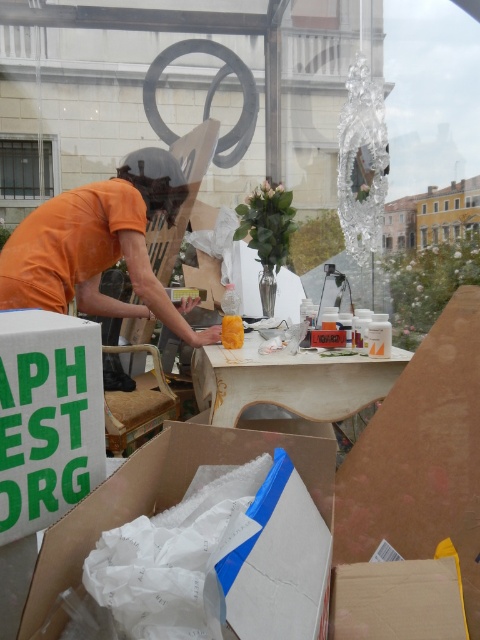
Can you confirm if orange cotton shirt at left is thinner than white foam at lower left?

No, orange cotton shirt at left is not thinner than white foam at lower left.

Which of these two, orange cotton shirt at left or white foam at lower left, stands shorter?

With less height is white foam at lower left.

At what (x,y) coordinates should I click in order to perform the action: click on orange cotton shirt at left. Please return your answer as a coordinate pair (x, y). Image resolution: width=480 pixels, height=640 pixels. Looking at the image, I should click on pos(99,246).

You are a GUI agent. You are given a task and a screenshot of the screen. Output one action in this format:
    pyautogui.click(x=<x>, y=<y>)
    Task: Click on the orange cotton shirt at left
    
    Given the screenshot: What is the action you would take?
    pyautogui.click(x=99, y=246)

Consider the image. Who is positioned more to the right, orange cotton shirt at left or wooden table at center?

Positioned to the right is wooden table at center.

This screenshot has height=640, width=480. What do you see at coordinates (99, 246) in the screenshot?
I see `orange cotton shirt at left` at bounding box center [99, 246].

Identify the location of orange cotton shirt at left. (99, 246).

Who is positioned more to the right, white foam at lower left or wooden table at center?

wooden table at center

Which of these two, white foam at lower left or wooden table at center, stands shorter?

With less height is white foam at lower left.

The width and height of the screenshot is (480, 640). Describe the element at coordinates (168, 493) in the screenshot. I see `white foam at lower left` at that location.

I want to click on white foam at lower left, so click(x=168, y=493).